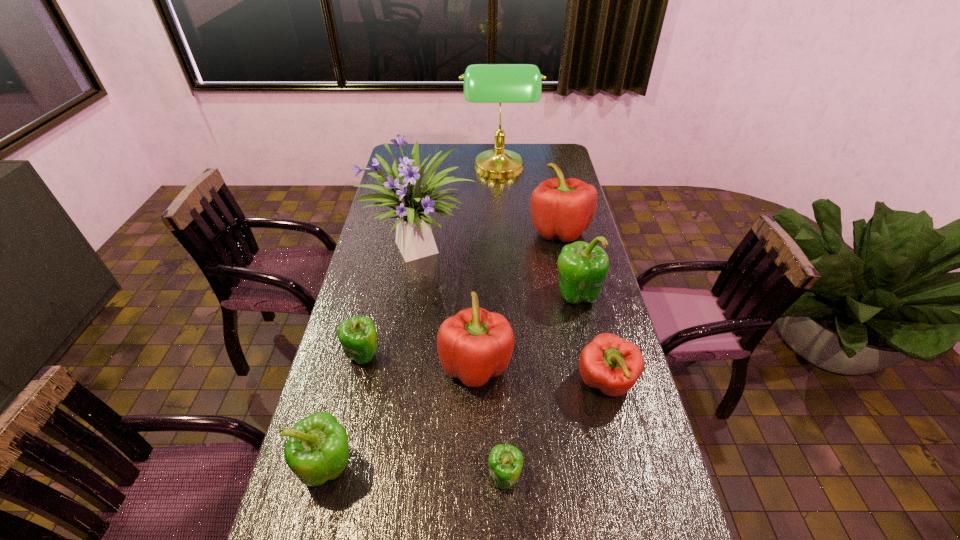
Locate an element on the screen. vacant space situated 0.140m on the right of the second biggest pink bell pepper is located at coordinates (560, 364).

Image resolution: width=960 pixels, height=540 pixels. I want to click on blank space located on the right of the third nearest green bell pepper, so click(494, 355).

This screenshot has height=540, width=960. Identify the location of vacant area situated on the left of the smallest pink bell pepper. (547, 383).

I want to click on free region located 0.300m on the right of the shortest object, so click(x=646, y=477).

Identify the location of object positioned at the far edge. The width and height of the screenshot is (960, 540). (483, 83).

The width and height of the screenshot is (960, 540). What are the coordinates of `flower arrangement located in the left edge section of the desktop` in the screenshot? It's located at (412, 201).

In the image, there is a desktop. Identify the location of vacant area at the far edge. Image resolution: width=960 pixels, height=540 pixels. (451, 147).

This screenshot has height=540, width=960. Find the location of `vacant region at the left edge of the desktop`. vacant region at the left edge of the desktop is located at coordinates (385, 249).

The height and width of the screenshot is (540, 960). In order to click on free spot at the right edge of the desktop in this screenshot , I will do `click(542, 172)`.

Where is `free space between the farthest pink bell pepper and the leftmost pink bell pepper`? This screenshot has width=960, height=540. free space between the farthest pink bell pepper and the leftmost pink bell pepper is located at coordinates (517, 298).